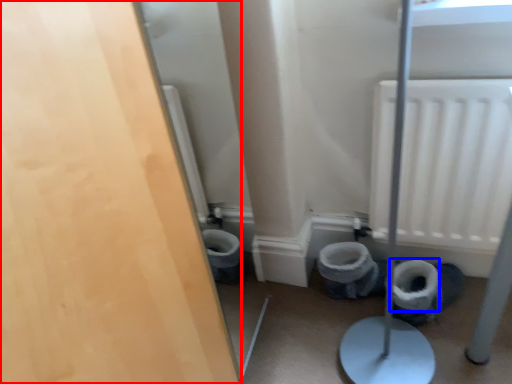
Question: Which point is further to the camera, door (highlighted by a red box) or toilet paper (highlighted by a blue box)?

Choices:
 (A) door
 (B) toilet paper

Answer: (B)